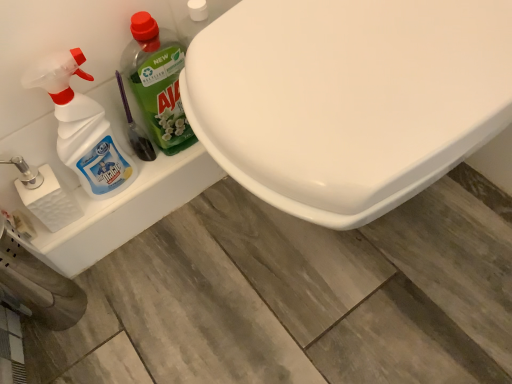
The width and height of the screenshot is (512, 384). Find the location of `free spot above white glossy toilet at center (from a real-world perspective)`. free spot above white glossy toilet at center (from a real-world perspective) is located at coordinates (348, 66).